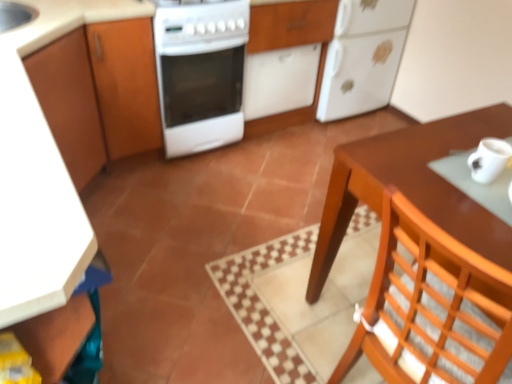
Question: Is brown wooden table at right closer to the viewer compared to white glossy stove at center?

Choices:
 (A) yes
 (B) no

Answer: (A)

Question: Can you confirm if brown wooden table at right is bigger than white glossy stove at center?

Choices:
 (A) no
 (B) yes

Answer: (B)

Question: Is brown wooden table at right oriented towards white glossy stove at center?

Choices:
 (A) no
 (B) yes

Answer: (A)

Question: Are brown wooden table at right and white glossy stove at center making contact?

Choices:
 (A) no
 (B) yes

Answer: (A)

Question: From a real-world perspective, is brown wooden table at right located beneath white glossy stove at center?

Choices:
 (A) yes
 (B) no

Answer: (B)

Question: From the image's perspective, is brown wooden table at right located above white glossy stove at center?

Choices:
 (A) no
 (B) yes

Answer: (A)

Question: From the image's perspective, is white matte refrigerator at upper right below brown wooden table at right?

Choices:
 (A) yes
 (B) no

Answer: (B)

Question: Does white matte refrigerator at upper right have a greater width compared to brown wooden table at right?

Choices:
 (A) yes
 (B) no

Answer: (B)

Question: Considering the relative sizes of white matte refrigerator at upper right and brown wooden table at right in the image provided, is white matte refrigerator at upper right smaller than brown wooden table at right?

Choices:
 (A) no
 (B) yes

Answer: (B)

Question: From the image's perspective, is white matte refrigerator at upper right above brown wooden table at right?

Choices:
 (A) yes
 (B) no

Answer: (A)

Question: Is white matte refrigerator at upper right completely or partially outside of brown wooden table at right?

Choices:
 (A) no
 (B) yes

Answer: (B)

Question: Is white matte refrigerator at upper right thinner than brown wooden table at right?

Choices:
 (A) yes
 (B) no

Answer: (A)

Question: Is brown wooden table at right behind wooden chair at lower right?

Choices:
 (A) no
 (B) yes

Answer: (B)